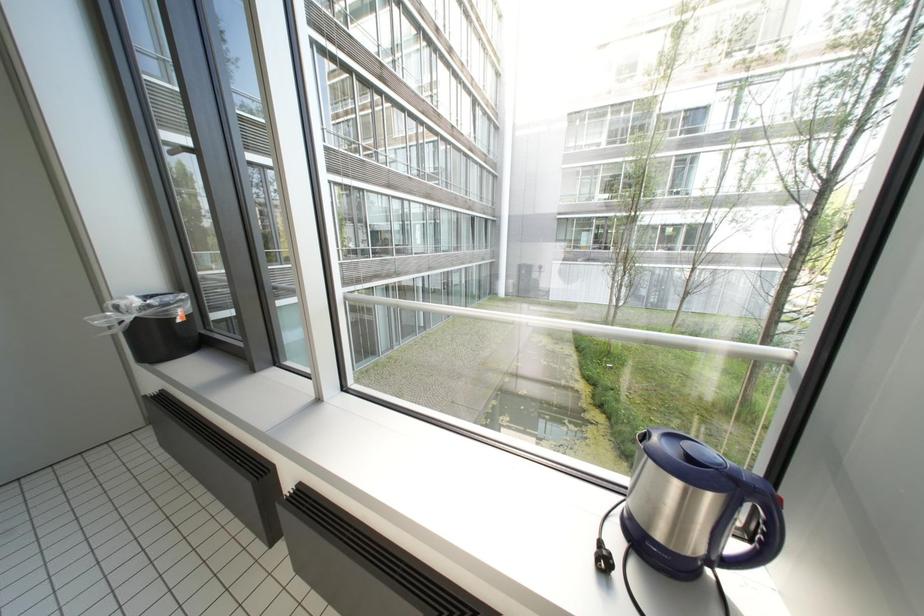
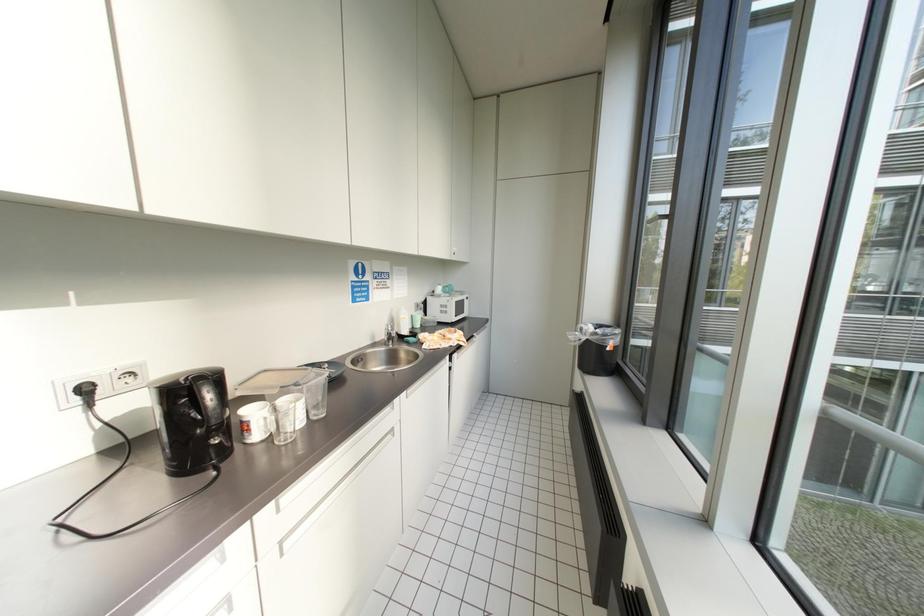
Question: How did the camera likely rotate?

Choices:
 (A) Left
 (B) Right
 (C) Up
 (D) Down

Answer: (A)